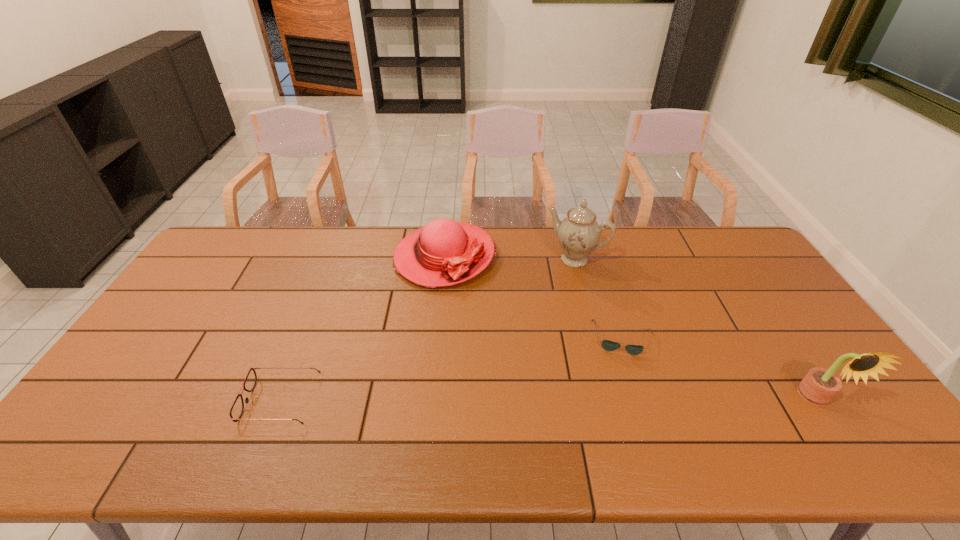
In order to click on free spot between the chinaware and the sunflower in this screenshot , I will do `click(695, 329)`.

Where is `vacant region between the rightmost object and the chinaware`? vacant region between the rightmost object and the chinaware is located at coordinates (x=695, y=329).

Locate an element on the screen. The image size is (960, 540). unoccupied area between the third nearest object and the chinaware is located at coordinates (599, 299).

The height and width of the screenshot is (540, 960). I want to click on vacant area that lies between the chinaware and the rightmost object, so click(695, 329).

Locate an element on the screen. The height and width of the screenshot is (540, 960). free area in between the rightmost object and the left sunglasses is located at coordinates (548, 400).

Find the location of `free space that is in between the chinaware and the rightmost object`. free space that is in between the chinaware and the rightmost object is located at coordinates (695, 329).

The width and height of the screenshot is (960, 540). Identify the location of free space that is in between the farther sunglasses and the fourth tallest object. (452, 369).

At what (x,y) coordinates should I click in order to perform the action: click on free point between the chinaware and the farther sunglasses. Please return your answer as a coordinate pair (x, y). The image size is (960, 540). Looking at the image, I should click on (599, 299).

I want to click on free space that is in between the chinaware and the sunflower, so click(x=695, y=329).

The image size is (960, 540). Find the location of `vacant space that is in between the third tallest object and the rightmost object`. vacant space that is in between the third tallest object and the rightmost object is located at coordinates (631, 328).